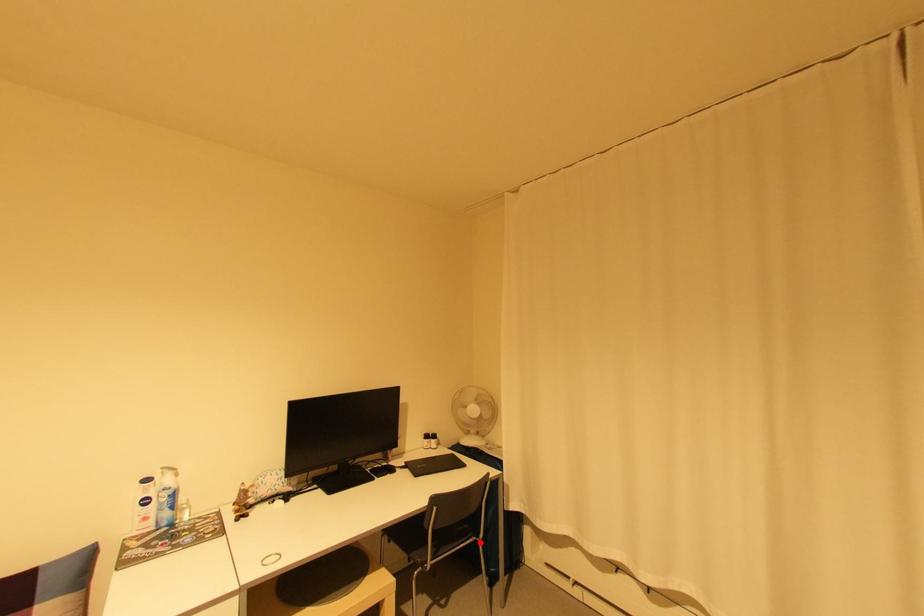
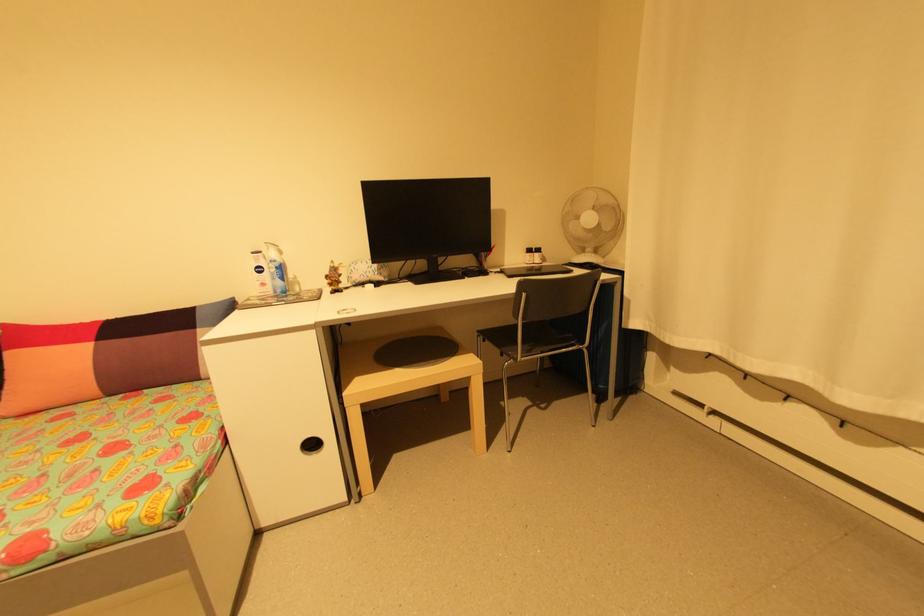
The point at the highlighted location is marked in the first image. Where is the corresponding point in the second image?

(585, 352)